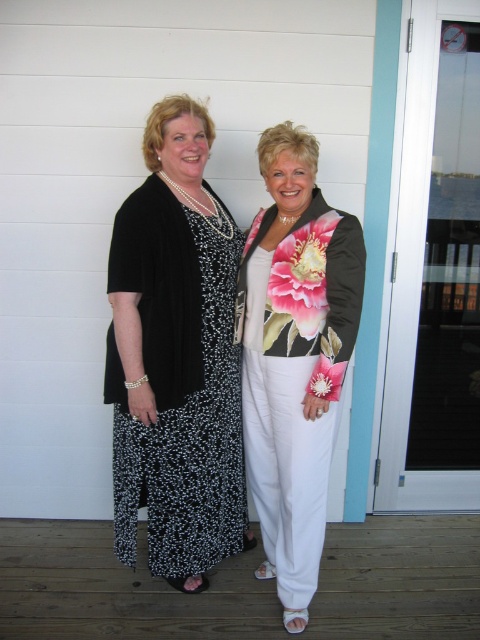
Can you confirm if black dotted dress at left is positioned to the right of floral satin jacket at center?

No, black dotted dress at left is not to the right of floral satin jacket at center.

Find the location of `black dotted dress at left`. black dotted dress at left is located at coordinates (178, 385).

The image size is (480, 640). Identify the location of black dotted dress at left. (178, 385).

Is white wood porch at lower center smaller than floral satin jacket at center?

Correct, white wood porch at lower center occupies less space than floral satin jacket at center.

Between white wood porch at lower center and floral satin jacket at center, which one appears on the left side from the viewer's perspective?

From the viewer's perspective, white wood porch at lower center appears more on the left side.

Is point (398, 634) in front of point (324, 456)?

No, (398, 634) is further to viewer.

Where is `white wood porch at lower center`? white wood porch at lower center is located at coordinates (243, 586).

Is white wood porch at lower center shorter than black dotted dress at left?

Indeed, white wood porch at lower center has a lesser height compared to black dotted dress at left.

Find the location of a particular element. The width and height of the screenshot is (480, 640). white wood porch at lower center is located at coordinates (243, 586).